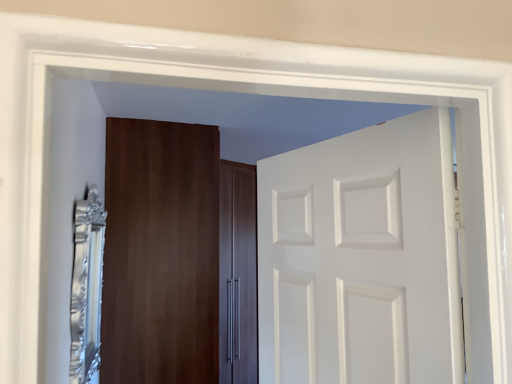
Question: From a real-world perspective, is white matte door at center, which is the 1th door in front-to-back order, beneath matte wood cabinet at center, which is the 2th door from right to left?

Choices:
 (A) no
 (B) yes

Answer: (A)

Question: Considering the relative positions of white matte door at center, which ranks as the 2th door in left-to-right order, and matte wood cabinet at center, which ranks as the 1th door in left-to-right order, in the image provided, is white matte door at center, which ranks as the 2th door in left-to-right order, to the right of matte wood cabinet at center, which ranks as the 1th door in left-to-right order, from the viewer's perspective?

Choices:
 (A) yes
 (B) no

Answer: (A)

Question: From a real-world perspective, is white matte door at center, which ranks as the 2th door in left-to-right order, positioned over matte wood cabinet at center, which is the 2th door from right to left, based on gravity?

Choices:
 (A) no
 (B) yes

Answer: (B)

Question: Does white matte door at center, which appears as the first door when viewed from the right, have a greater height compared to matte wood cabinet at center, arranged as the 2th door when viewed from the front?

Choices:
 (A) no
 (B) yes

Answer: (A)

Question: Can you confirm if white matte door at center, the second door viewed from the back, is smaller than matte wood cabinet at center, which is the 2th door from right to left?

Choices:
 (A) yes
 (B) no

Answer: (A)

Question: Considering the relative sizes of white matte door at center, which appears as the first door when viewed from the right, and matte wood cabinet at center, the first door positioned from the back, in the image provided, is white matte door at center, which appears as the first door when viewed from the right, thinner than matte wood cabinet at center, the first door positioned from the back,?

Choices:
 (A) no
 (B) yes

Answer: (B)

Question: Considering the relative sizes of matte wood cabinet at center, the first door positioned from the back, and silver metallic mirror at left in the image provided, is matte wood cabinet at center, the first door positioned from the back, wider than silver metallic mirror at left?

Choices:
 (A) yes
 (B) no

Answer: (A)

Question: Is matte wood cabinet at center, which is the 2th door from right to left, positioned far away from silver metallic mirror at left?

Choices:
 (A) no
 (B) yes

Answer: (A)

Question: Is matte wood cabinet at center, which is the 2th door from right to left, looking in the opposite direction of silver metallic mirror at left?

Choices:
 (A) yes
 (B) no

Answer: (B)

Question: Is silver metallic mirror at left inside matte wood cabinet at center, arranged as the 2th door when viewed from the front?

Choices:
 (A) no
 (B) yes

Answer: (A)

Question: Considering the relative sizes of matte wood cabinet at center, which ranks as the 1th door in left-to-right order, and silver metallic mirror at left in the image provided, is matte wood cabinet at center, which ranks as the 1th door in left-to-right order, shorter than silver metallic mirror at left?

Choices:
 (A) no
 (B) yes

Answer: (A)

Question: From the image's perspective, is matte wood cabinet at center, which is the 2th door from right to left, located beneath silver metallic mirror at left?

Choices:
 (A) yes
 (B) no

Answer: (A)

Question: Is silver metallic mirror at left far away from matte wood cabinet at center, the first door positioned from the back?

Choices:
 (A) yes
 (B) no

Answer: (B)